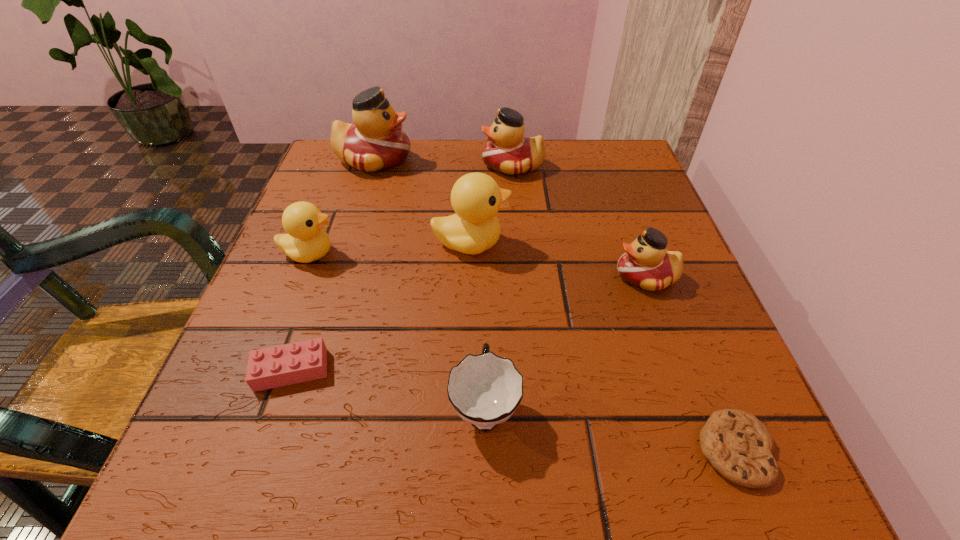
Identify which object is the second nearest to the cup. Please provide its 2D coordinates. Your answer should be formatted as a tuple, i.e. [(x, y)], where the tuple contains the x and y coordinates of a point satisfying the conditions above.

[(476, 198)]

Choose which duck is the fourth nearest neighbor to the leftmost red duck. Please provide its 2D coordinates. Your answer should be formatted as a tuple, i.e. [(x, y)], where the tuple contains the x and y coordinates of a point satisfying the conditions above.

[(646, 264)]

I want to click on duck that is the fourth closest to the brown cookie, so click(x=306, y=241).

Point out which red duck is positioned as the nearest to the second shortest object. Please provide its 2D coordinates. Your answer should be formatted as a tuple, i.e. [(x, y)], where the tuple contains the x and y coordinates of a point satisfying the conditions above.

[(375, 142)]

Identify the location of the second closest red duck relative to the bigger yellow duck. (375, 142).

Where is `vacant region that satisfies the following two spatial constraints: 1. on the face of the leftmost red duck; 2. on the back side of the cookie`? This screenshot has height=540, width=960. vacant region that satisfies the following two spatial constraints: 1. on the face of the leftmost red duck; 2. on the back side of the cookie is located at coordinates (283, 450).

This screenshot has width=960, height=540. Find the location of `free point that satisfies the following two spatial constraints: 1. on the face of the biggest red duck; 2. on the back side of the brown cookie`. free point that satisfies the following two spatial constraints: 1. on the face of the biggest red duck; 2. on the back side of the brown cookie is located at coordinates click(x=283, y=450).

What are the coordinates of `vacant space that satisfies the following two spatial constraints: 1. on the face of the leftmost red duck; 2. on the right side of the cookie` in the screenshot? It's located at (283, 450).

Image resolution: width=960 pixels, height=540 pixels. In order to click on free location that satisfies the following two spatial constraints: 1. on the face of the nearest red duck; 2. on the front side of the Lego in this screenshot , I will do `click(680, 370)`.

The image size is (960, 540). I want to click on free spot that satisfies the following two spatial constraints: 1. on the face of the left yellow duck; 2. on the back side of the cookie, so click(x=233, y=450).